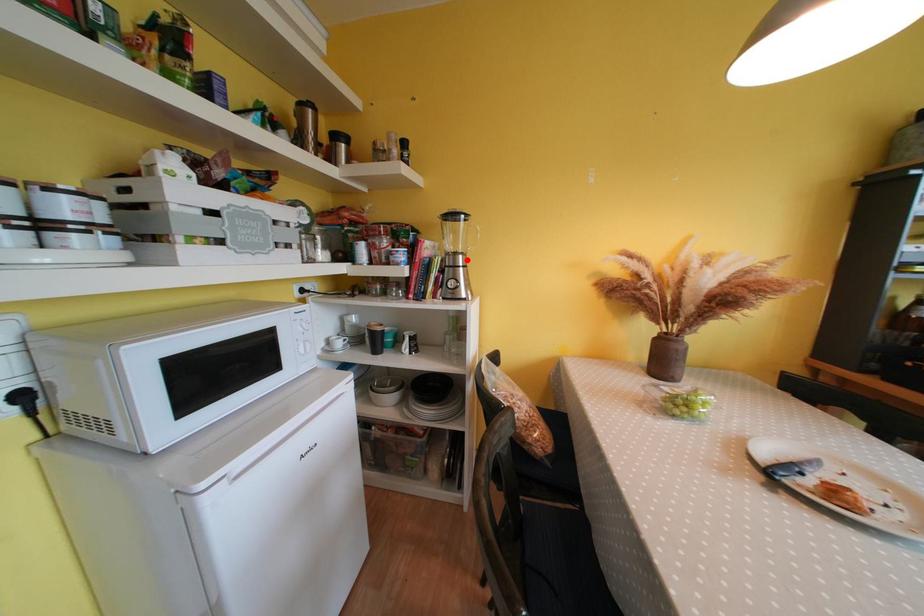
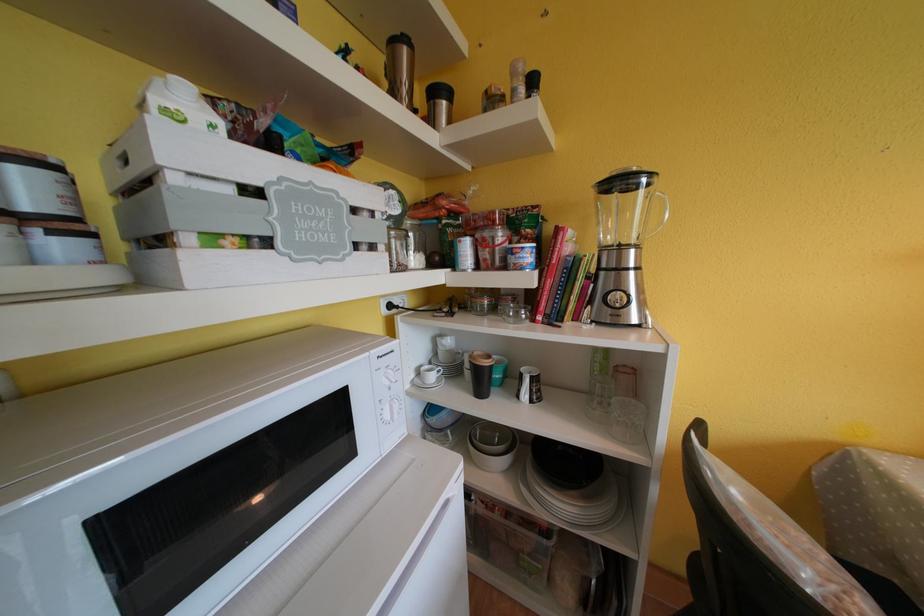
Where in the second image is the point corresponding to the highlighted location from the first image?

(638, 254)